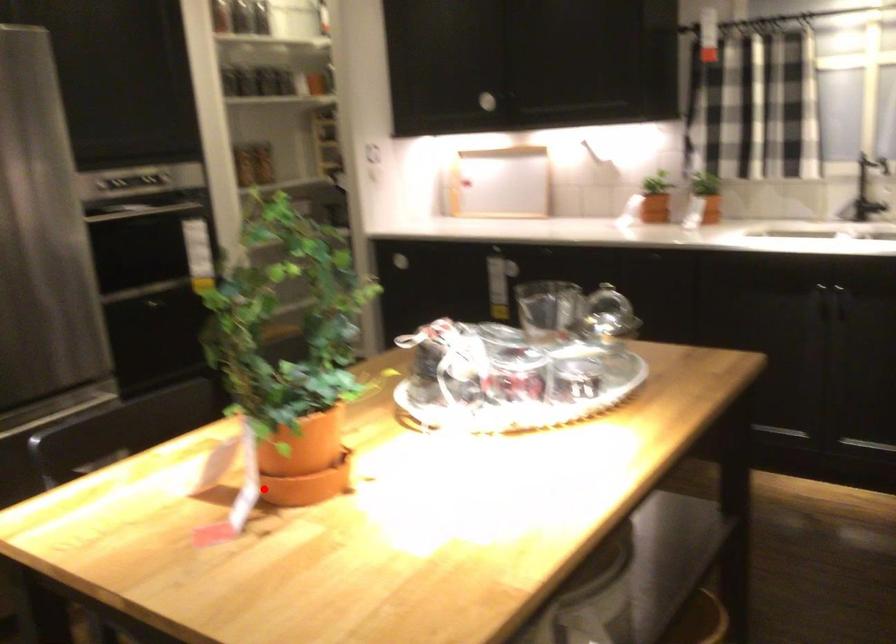
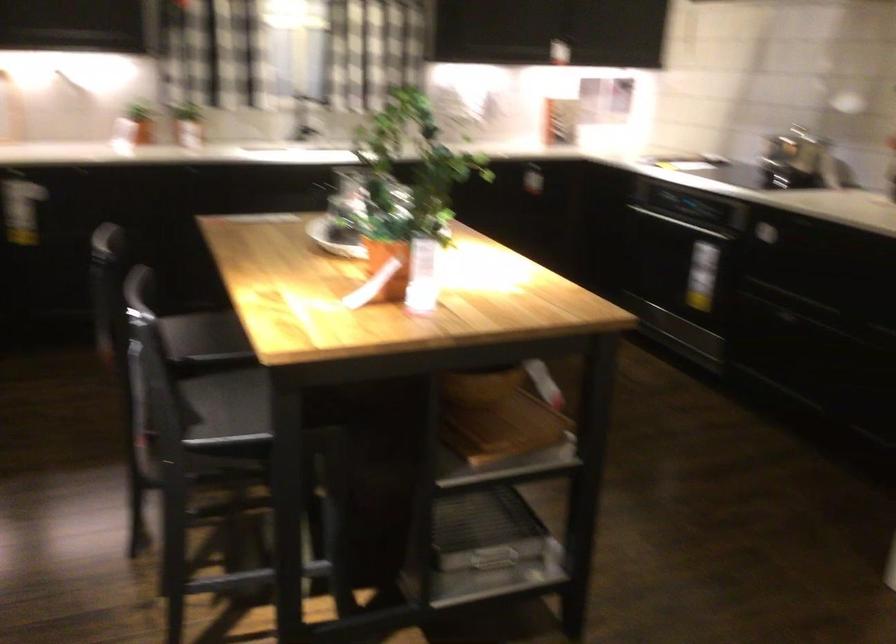
Question: A red point is marked in image1. In image2, is the corresponding 3D point closer to the camera or farther? Reply with the corresponding letter.

Choices:
 (A) The corresponding 3D point is closer.
 (B) The corresponding 3D point is farther.

Answer: (B)